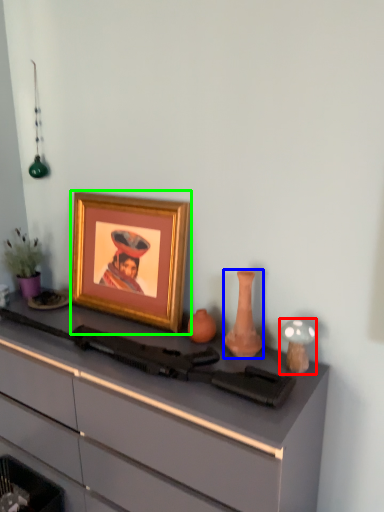
Question: Considering the real-world distances, which object is farthest from candle holder (highlighted by a red box)? vase (highlighted by a blue box) or picture frame (highlighted by a green box)?

Choices:
 (A) vase
 (B) picture frame

Answer: (B)